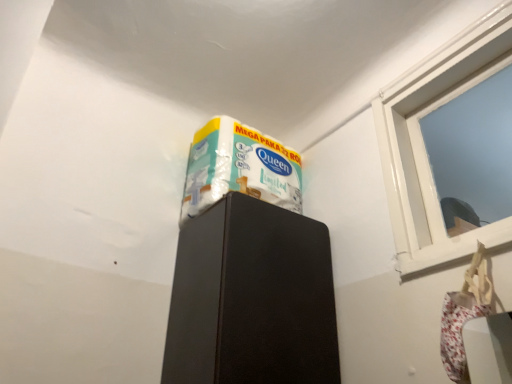
Question: Is white glossy window at upper right not within white glossy wrapping paper at upper center?

Choices:
 (A) no
 (B) yes

Answer: (B)

Question: Is the depth of white glossy window at upper right less than that of white glossy wrapping paper at upper center?

Choices:
 (A) no
 (B) yes

Answer: (B)

Question: Considering the relative positions of white glossy window at upper right and white glossy wrapping paper at upper center in the image provided, is white glossy window at upper right to the right of white glossy wrapping paper at upper center from the viewer's perspective?

Choices:
 (A) yes
 (B) no

Answer: (A)

Question: Considering the relative sizes of white glossy window at upper right and white glossy wrapping paper at upper center in the image provided, is white glossy window at upper right thinner than white glossy wrapping paper at upper center?

Choices:
 (A) no
 (B) yes

Answer: (B)

Question: Considering the relative sizes of white glossy window at upper right and white glossy wrapping paper at upper center in the image provided, is white glossy window at upper right wider than white glossy wrapping paper at upper center?

Choices:
 (A) yes
 (B) no

Answer: (B)

Question: Can you confirm if white glossy window at upper right is smaller than white glossy wrapping paper at upper center?

Choices:
 (A) no
 (B) yes

Answer: (B)

Question: From a real-world perspective, is white glossy window at upper right under black matte cabinet at upper center?

Choices:
 (A) no
 (B) yes

Answer: (A)

Question: Can you confirm if white glossy window at upper right is thinner than black matte cabinet at upper center?

Choices:
 (A) yes
 (B) no

Answer: (A)

Question: Is white glossy window at upper right directly adjacent to black matte cabinet at upper center?

Choices:
 (A) yes
 (B) no

Answer: (B)

Question: Considering the relative positions of white glossy window at upper right and black matte cabinet at upper center in the image provided, is white glossy window at upper right in front of black matte cabinet at upper center?

Choices:
 (A) no
 (B) yes

Answer: (B)

Question: Does white glossy window at upper right appear on the left side of black matte cabinet at upper center?

Choices:
 (A) yes
 (B) no

Answer: (B)

Question: Is white glossy window at upper right surrounding black matte cabinet at upper center?

Choices:
 (A) no
 (B) yes

Answer: (A)

Question: Is black matte cabinet at upper center oriented away from white glossy window at upper right?

Choices:
 (A) yes
 (B) no

Answer: (B)